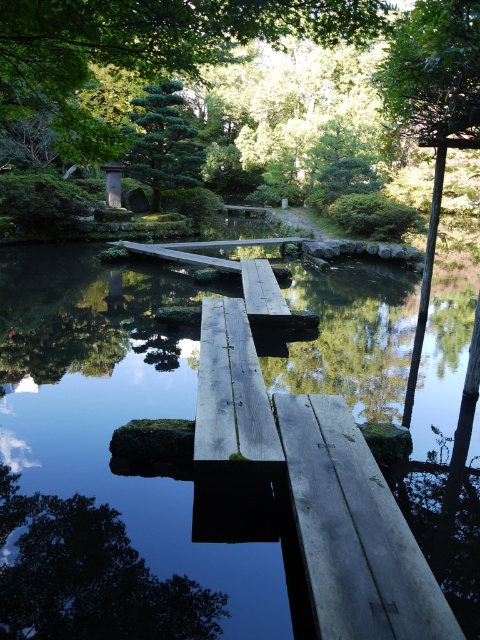
You are standing at the point marked as point (88, 577) in the Japanese garden scene. What object is located at this specific coordinate?

The green matte tree at lower left is located at point (88, 577).

In the scene shown: You are standing at the point with coordinates (215,387) in the Japanese garden scene. What object is exactly at your current location?

The wooden plank at center is located at point 0.448, 0.606.